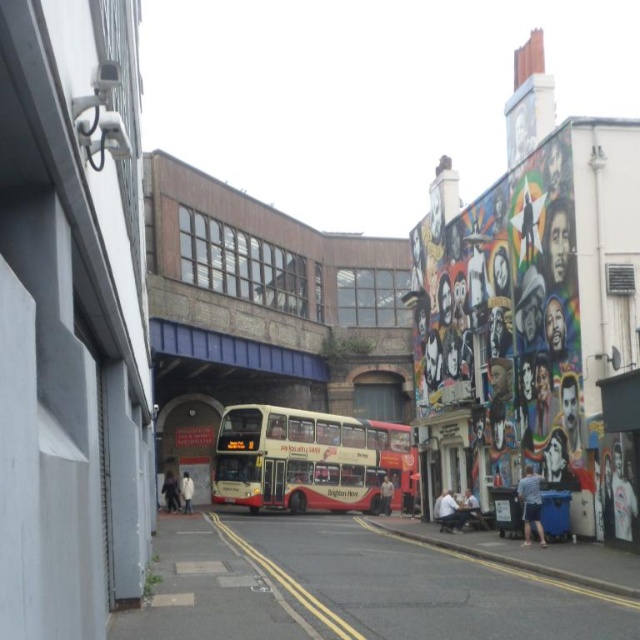
Question: Among these objects, which one is nearest to the camera?

Choices:
 (A) dark gray jacket at lower left
 (B) blue metallic bridge at center
 (C) white painted wall at right

Answer: (C)

Question: Is blue metallic bridge at center below light brown leather jacket at center?

Choices:
 (A) yes
 (B) no

Answer: (B)

Question: Based on their relative distances, which object is nearer to the red metallic bus at center?

Choices:
 (A) light blue jeans at lower right
 (B) dark gray jacket at lower left
 (C) beige metallic bus at center

Answer: (C)

Question: Can you confirm if red metallic bus at center is thinner than dark gray jacket at lower left?

Choices:
 (A) yes
 (B) no

Answer: (B)

Question: Does dark gray jacket at lower left come behind white matte jacket at center?

Choices:
 (A) yes
 (B) no

Answer: (A)

Question: Estimate the real-world distances between objects in this image. Which object is closer to the light blue jeans at lower right?

Choices:
 (A) light brown leather jacket at center
 (B) white painted wall at right
 (C) dark gray jacket at lower left
 (D) blue denim shorts at lower right

Answer: (D)